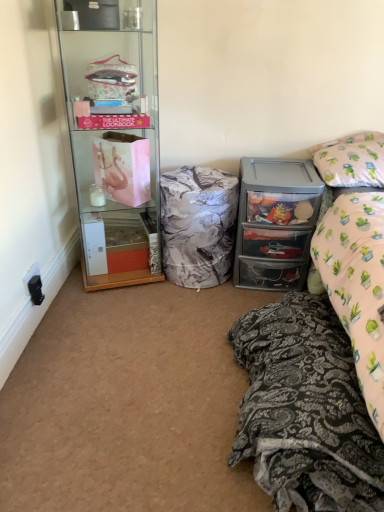
At what (x,y) coordinates should I click in order to perform the action: click on vacant area that lies between clear glass cabinet at left and patterned fabric bed at lower right. Please return your answer as a coordinate pair (x, y). Looking at the image, I should click on (177, 351).